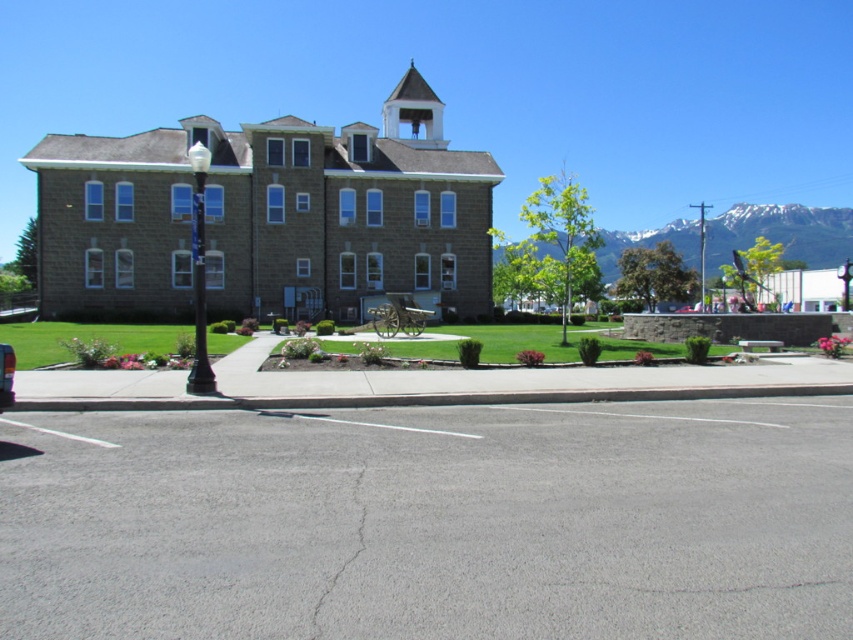
You are an architect planning to install a new flagpole on the roof of the gray stone church at center. The flagpole requires a minimum of 5 meters of vertical clearance above the highest point of the building. Given that the white stucco bell tower at upper center is taller than the church, can you determine if the flagpole will have enough clearance?

The gray stone church at center is not as tall as the white stucco bell tower at upper center. Since the bell tower is taller, the flagpole installed on the church roof may not have enough clearance if the bell tower exceeds the required 5 meters. However, without specific height measurements, it is impossible to confirm the exact clearance available.

You are an architect reviewing the design of the gray stone church at center and the white stucco bell tower at upper center. Which structure takes up more area in the image?

The white stucco bell tower at upper center takes up more area in the image than the gray stone church at center, as it occupies more space according to the description.

You are a photographer planning to take a picture of the white stucco bell tower at upper center and the metallic silver car at lower left from the lawn. Considering their sizes, which object should you focus on first to ensure both are in frame?

The white stucco bell tower at upper center is larger in size than the metallic silver car at lower left, so you should focus on the white stucco bell tower at upper center first to ensure both fit within the frame.